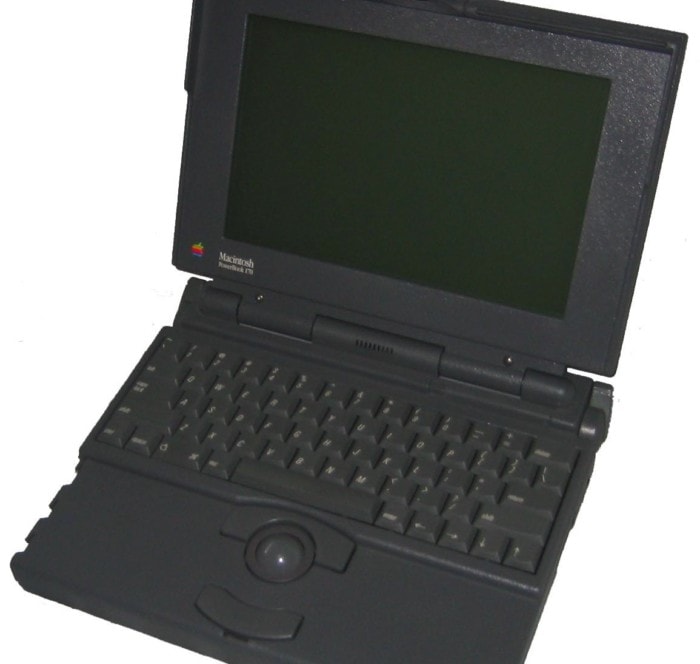
The image size is (700, 664). Identify the location of black monitor border. (477, 40), (605, 272), (183, 145), (377, 287).